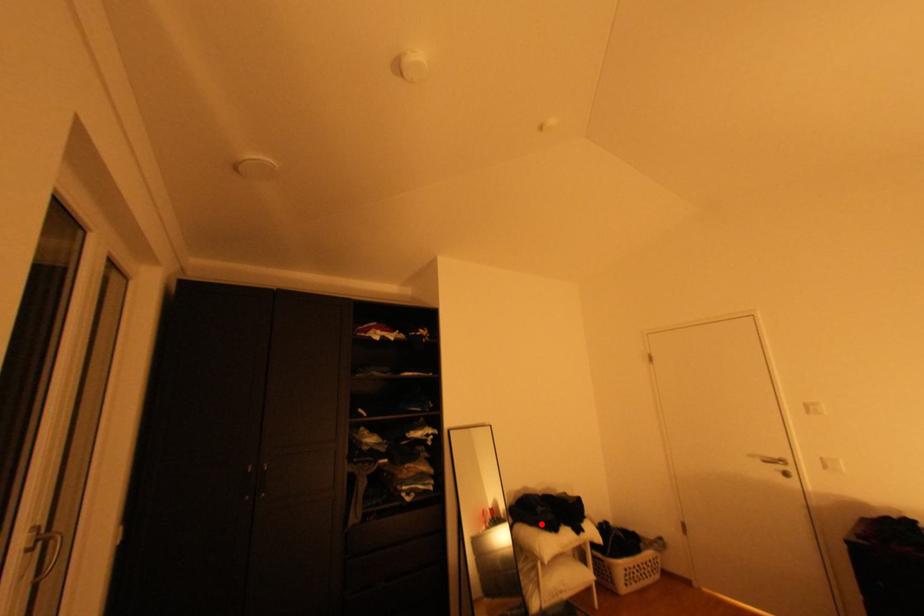
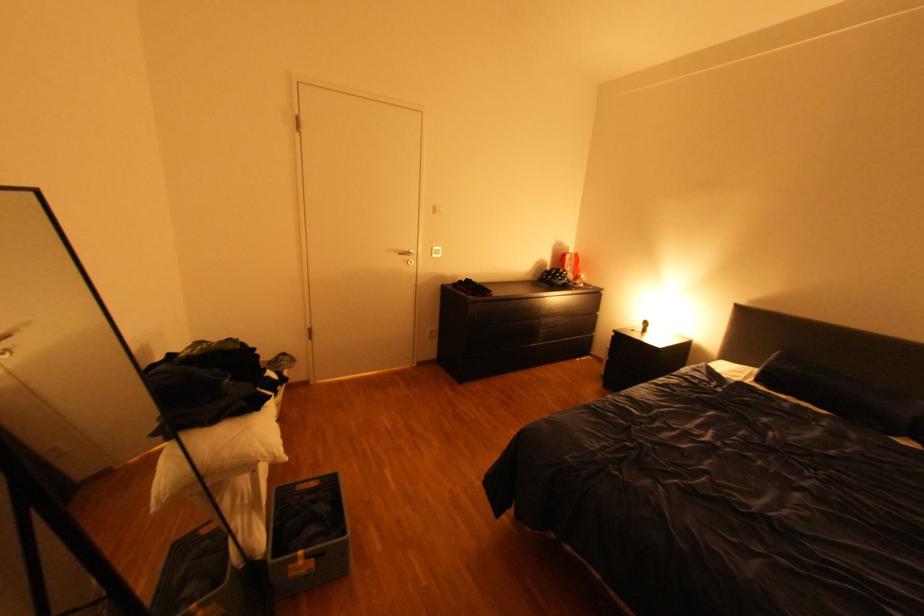
Question: I am providing you with two images of the same scene from different viewpoints. Image1 has a red point marked. In image2, the corresponding 3D location appears at what relative position? Reply with the corresponding letter.

Choices:
 (A) Closer
 (B) Farther

Answer: (A)